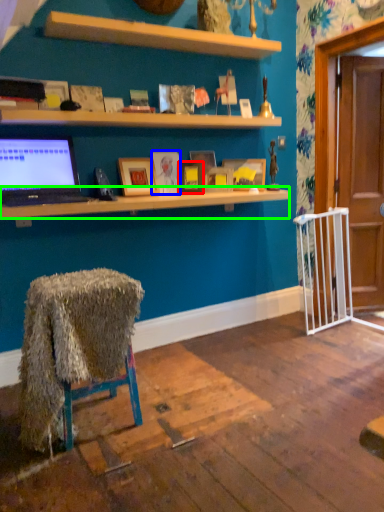
Question: Considering the real-world distances, which object is farthest from picture frame (highlighted by a red box)? picture frame (highlighted by a blue box) or desk (highlighted by a green box)?

Choices:
 (A) picture frame
 (B) desk

Answer: (B)